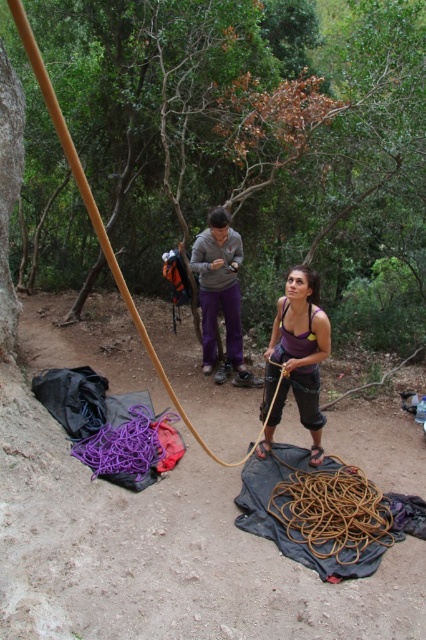
You are a climber preparing to secure your gear. You have a brown rope at lower center and a matte gray hoodie at center. Which item is shorter in height?

The brown rope at lower center has a lesser height compared to the matte gray hoodie at center, so the brown rope at lower center is shorter.

You are a climber preparing to secure your harness. You have a brown rope at lower center and a matte gray hoodie at center. Which item is positioned to the right of the other?

The brown rope at lower center is to the right of the matte gray hoodie at center.

You are a climber preparing to set up an anchor point. You have a brown wood pole at center and a brown rope at lower center. Which object should you interact with first to ensure the rope is properly secured?

You should interact with the brown wood pole at center first because the brown rope at lower center is behind it, making the pole more accessible to secure the rope properly.